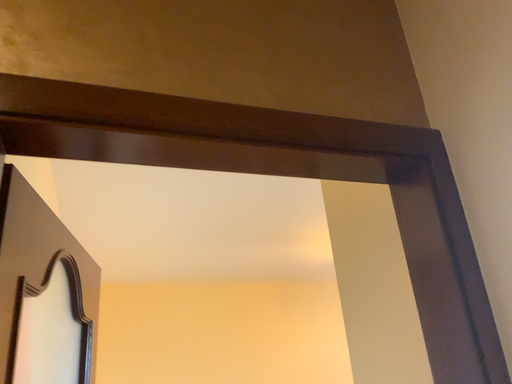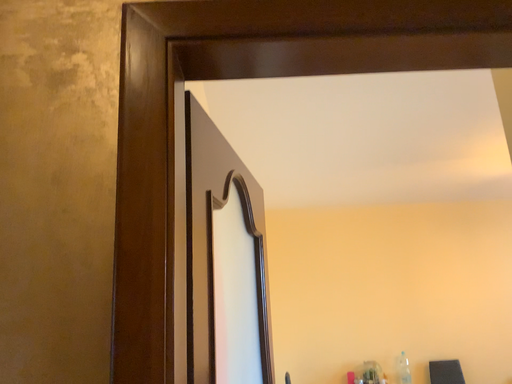
Question: Which way did the camera rotate in the video?

Choices:
 (A) rotated upward
 (B) rotated downward

Answer: (B)